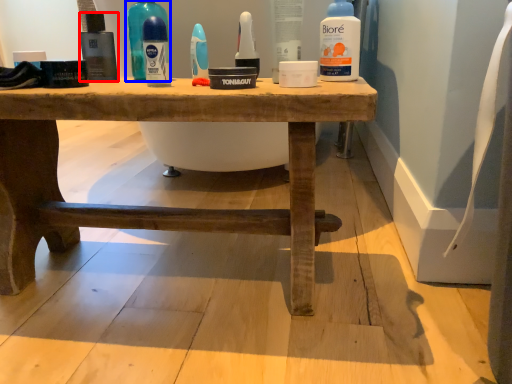
Question: Which of the following is the closest to the observer, mouthwash (highlighted by a red box) or cleaning product (highlighted by a blue box)?

Choices:
 (A) mouthwash
 (B) cleaning product

Answer: (B)